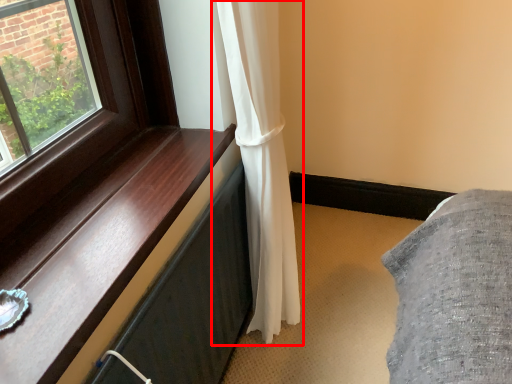
Question: From the image, what is the correct spatial relationship of curtain (annotated by the red box) in relation to window sill?

Choices:
 (A) left
 (B) right

Answer: (B)